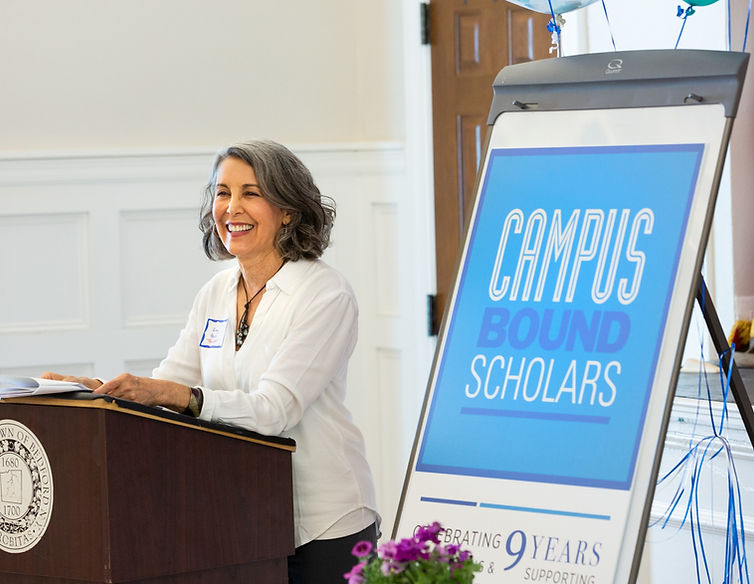
Locate an element on the screen. Image resolution: width=754 pixels, height=584 pixels. documents is located at coordinates (51, 384).